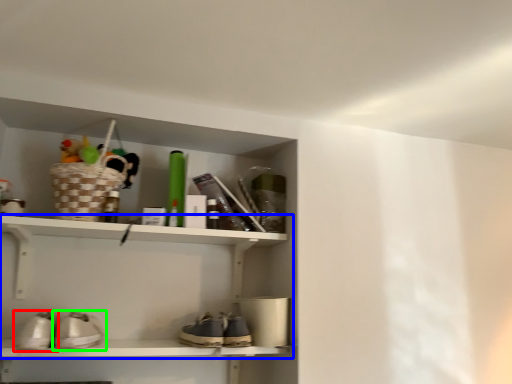
Question: Which object is positioned farthest from footwear (highlighted by a red box)? Select from shelf (highlighted by a blue box) and footwear (highlighted by a green box).

Choices:
 (A) shelf
 (B) footwear

Answer: (A)